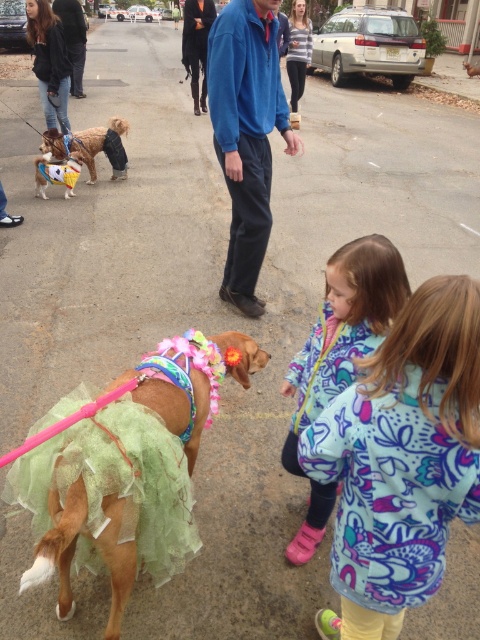
From the picture: Can you confirm if green tulle skirt at upper left is thinner than brown plush dog at left?

Indeed, green tulle skirt at upper left has a lesser width compared to brown plush dog at left.

Is green tulle skirt at upper left above brown plush dog at left?

Indeed, green tulle skirt at upper left is positioned over brown plush dog at left.

Locate an element on the screen. Image resolution: width=480 pixels, height=640 pixels. green tulle skirt at upper left is located at coordinates (48, 61).

Based on the photo, can you confirm if blue fleece jacket at center is thinner than fluffy fleece jacket at lower right?

In fact, blue fleece jacket at center might be wider than fluffy fleece jacket at lower right.

Describe the element at coordinates (247, 134) in the screenshot. I see `blue fleece jacket at center` at that location.

Image resolution: width=480 pixels, height=640 pixels. In order to click on blue fleece jacket at center in this screenshot , I will do `click(247, 134)`.

The width and height of the screenshot is (480, 640). I want to click on brown plush dog at left, so click(x=91, y=145).

Is brown plush dog at left closer to the viewer compared to striped fabric shirt at center?

Yes, it is in front of striped fabric shirt at center.

Where is `brown plush dog at left`? Image resolution: width=480 pixels, height=640 pixels. brown plush dog at left is located at coordinates (91, 145).